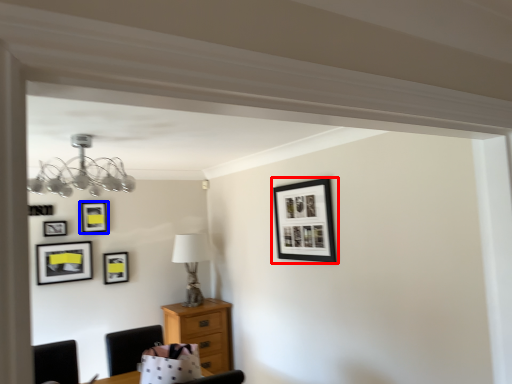
Question: Which object is further to the camera taking this photo, picture frame (highlighted by a red box) or picture frame (highlighted by a blue box)?

Choices:
 (A) picture frame
 (B) picture frame

Answer: (B)